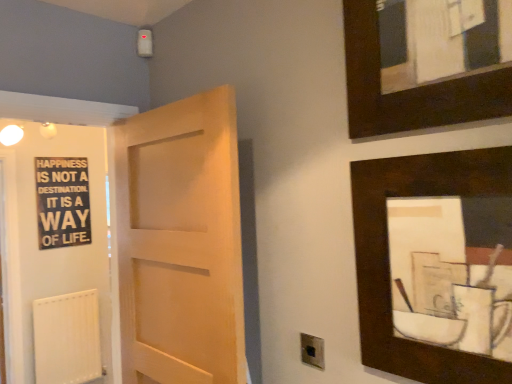
Question: From the image's perspective, is metallic silver electric outlet at lower center above or below black wood signboard at left?

Choices:
 (A) above
 (B) below

Answer: (B)

Question: Considering the positions of metallic silver electric outlet at lower center and black wood signboard at left in the image, is metallic silver electric outlet at lower center taller or shorter than black wood signboard at left?

Choices:
 (A) tall
 (B) short

Answer: (B)

Question: Which object is the closest to the light wood door at center?

Choices:
 (A) black matte signboard at left
 (B) metallic silver electric outlet at lower center
 (C) dark wood picture frame at upper right, which appears as the first picture frame when ordered from the bottom
 (D) dark wood picture frame at upper right, marked as the first picture frame in a top-to-bottom arrangement
 (E) black wood signboard at left

Answer: (B)

Question: Which of these objects is positioned farthest from the white matte radiator at lower left?

Choices:
 (A) dark wood picture frame at upper right, which appears as the first picture frame when ordered from the bottom
 (B) metallic silver electric outlet at lower center
 (C) black matte signboard at left
 (D) dark wood picture frame at upper right, positioned as the 2th picture frame in bottom-to-top order
 (E) light wood door at center

Answer: (D)